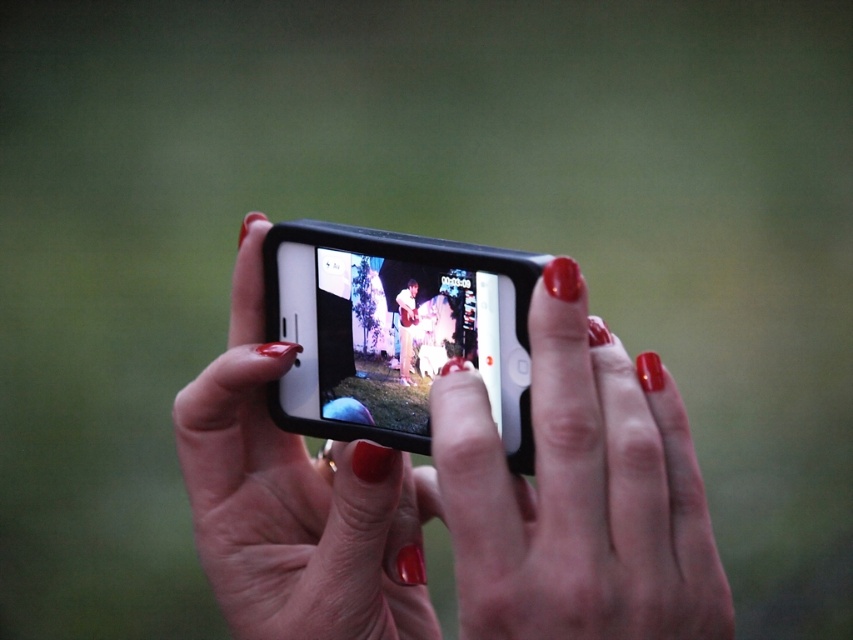
You are holding a smartphone and want to capture a clear photo of a distant object. The point where you need to focus is at point (x=450, y=456). Given that the distance between this point and the camera is 19.27 inches, would adjusting the focus to this point help in capturing the distant object clearly?

The distance between point (x=450, y=456) and the camera is 19.27 inches. Since the focus is set to this point, it would only ensure clarity for objects at that specific distance. To capture a distant object clearly, the focus should be adjusted to match the distance of that object instead.

You are a photographer trying to capture a clear shot of the nighttime event displayed on the black matte smartphone at center. However, the smooth white shirt at center is blocking your view. Can you adjust your position so that the smartphone screen is visible without obstruction?

The black matte smartphone at center is positioned under the smooth white shirt at center, so you can lower your angle or move your hand holding the smooth white shirt at center upwards to make the smartphone screen visible.

You are a photographer adjusting the focus on your smartphone. You notice two points on the screen at coordinates point (317, 353) and point (410, 284). Which point is closer to the camera lens?

Point (410, 284) is closer to the camera lens because it is in front of point (317, 353).